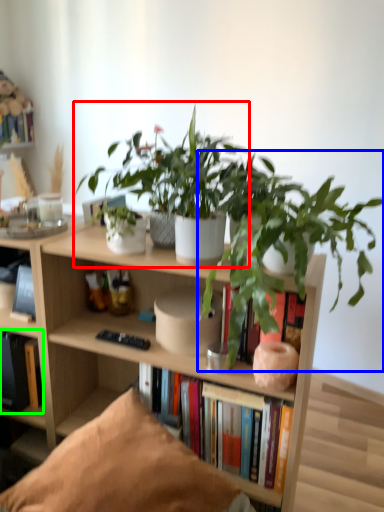
Question: Which is nearer to the houseplant (highlighted by a red box)? houseplant (highlighted by a blue box) or book (highlighted by a green box).

Choices:
 (A) houseplant
 (B) book

Answer: (A)